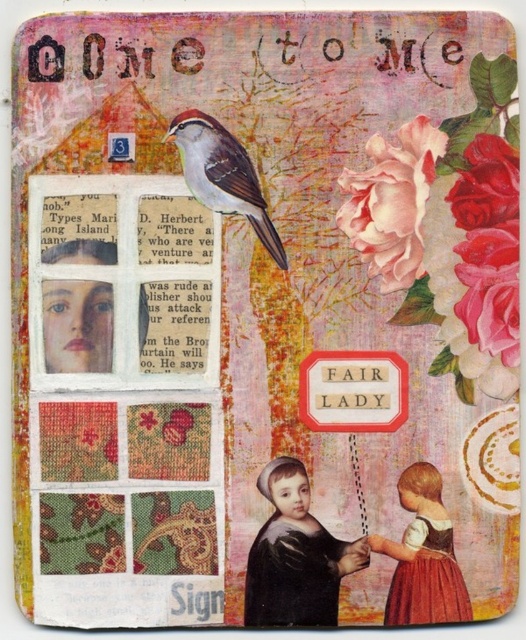
Can you confirm if matte brown dress at lower right is positioned to the left of matte brown bird at center?

Incorrect, matte brown dress at lower right is not on the left side of matte brown bird at center.

Based on the photo, is matte brown dress at lower right smaller than matte brown bird at center?

No, matte brown dress at lower right is not smaller than matte brown bird at center.

Who is more distant from viewer, (448, 620) or (175, 129)?

Point (175, 129)

The image size is (526, 640). In order to click on matte brown dress at lower right in this screenshot , I will do (423, 556).

Between matte black portrait at center and matte brown dress at lower right, which one has more height?

matte black portrait at center is taller.

The height and width of the screenshot is (640, 526). Identify the location of matte black portrait at center. (296, 556).

You are a GUI agent. You are given a task and a screenshot of the screen. Output one action in this format:
    pyautogui.click(x=<x>, y=<y>)
    Task: Click on the matte black portrait at center
    
    Given the screenshot: What is the action you would take?
    pyautogui.click(x=296, y=556)

Measure the distance between matte black portrait at center and matte brown bird at center.

matte black portrait at center and matte brown bird at center are 9.09 inches apart.

Consider the image. Does matte black portrait at center have a larger size compared to matte brown bird at center?

Correct, matte black portrait at center is larger in size than matte brown bird at center.

Between point (274, 476) and point (266, 211), which one is positioned in front?

Point (274, 476) is in front.

The height and width of the screenshot is (640, 526). I want to click on matte black portrait at center, so click(296, 556).